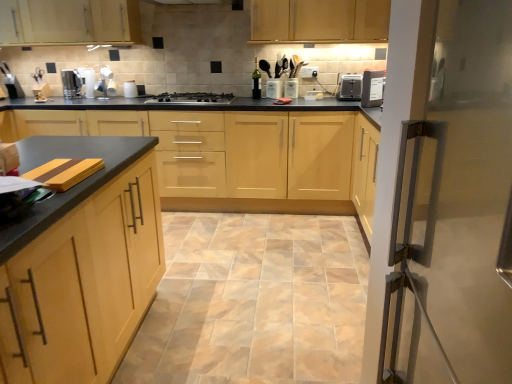
Question: From a real-world perspective, is black plastic toaster at upper right on stainless steel gas stove at center?

Choices:
 (A) no
 (B) yes

Answer: (B)

Question: Is black plastic toaster at upper right closer to camera compared to stainless steel gas stove at center?

Choices:
 (A) yes
 (B) no

Answer: (B)

Question: Is black plastic toaster at upper right beside stainless steel gas stove at center?

Choices:
 (A) no
 (B) yes

Answer: (A)

Question: Can stainless steel gas stove at center be found inside black plastic toaster at upper right?

Choices:
 (A) yes
 (B) no

Answer: (B)

Question: Is black plastic toaster at upper right behind stainless steel gas stove at center?

Choices:
 (A) no
 (B) yes

Answer: (B)

Question: Can you confirm if black plastic toaster at upper right is smaller than stainless steel gas stove at center?

Choices:
 (A) no
 (B) yes

Answer: (B)

Question: Is black plastic toaster at upper right touching beige ceramic tile at center?

Choices:
 (A) yes
 (B) no

Answer: (B)

Question: From the image's perspective, is black plastic toaster at upper right above beige ceramic tile at center?

Choices:
 (A) yes
 (B) no

Answer: (A)

Question: Is black plastic toaster at upper right oriented towards beige ceramic tile at center?

Choices:
 (A) no
 (B) yes

Answer: (A)

Question: Is black plastic toaster at upper right to the left of beige ceramic tile at center from the viewer's perspective?

Choices:
 (A) yes
 (B) no

Answer: (B)

Question: From a real-world perspective, does black plastic toaster at upper right sit lower than beige ceramic tile at center?

Choices:
 (A) no
 (B) yes

Answer: (A)

Question: From the image's perspective, is black plastic toaster at upper right beneath beige ceramic tile at center?

Choices:
 (A) yes
 (B) no

Answer: (B)

Question: From the image's perspective, is satin silver kettle at left located beneath matte wood cabinets at upper center, which is the 3th cabinetry in front-to-back order?

Choices:
 (A) yes
 (B) no

Answer: (A)